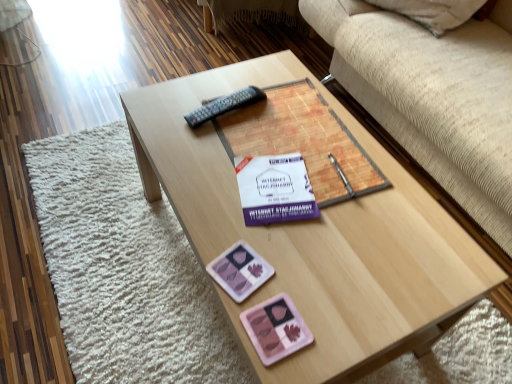
This screenshot has height=384, width=512. I want to click on free spot to the left of matte paper book at center, so click(181, 135).